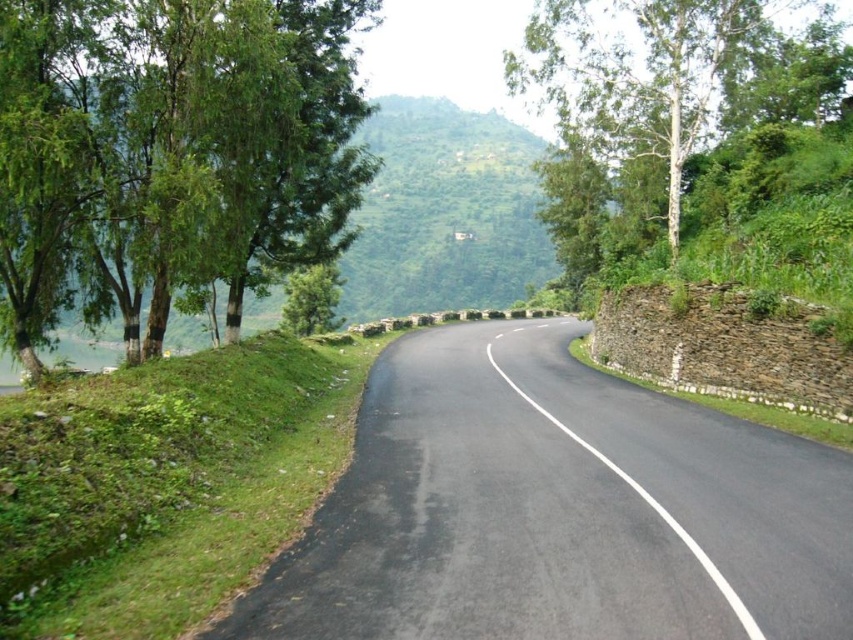
You are standing at the beginning of the road and want to take a photo that includes both point (x=19, y=20) and point (x=811, y=83). Which point will appear larger in the photo?

Point (x=19, y=20) will appear larger in the photo because it is closer to the camera than point (x=811, y=83).